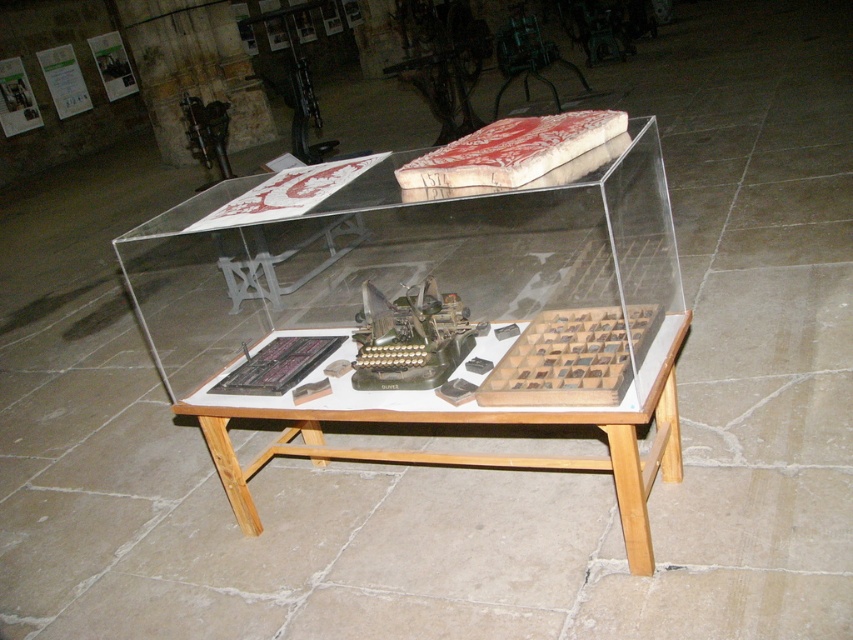
Can you confirm if transparent acrylic box at center is positioned to the left of wooden table at center?

Indeed, transparent acrylic box at center is positioned on the left side of wooden table at center.

Which is above, transparent acrylic box at center or wooden table at center?

transparent acrylic box at center is above.

Is point (447, 280) positioned after point (227, 400)?

Yes.

Locate an element on the screen. transparent acrylic box at center is located at coordinates (422, 278).